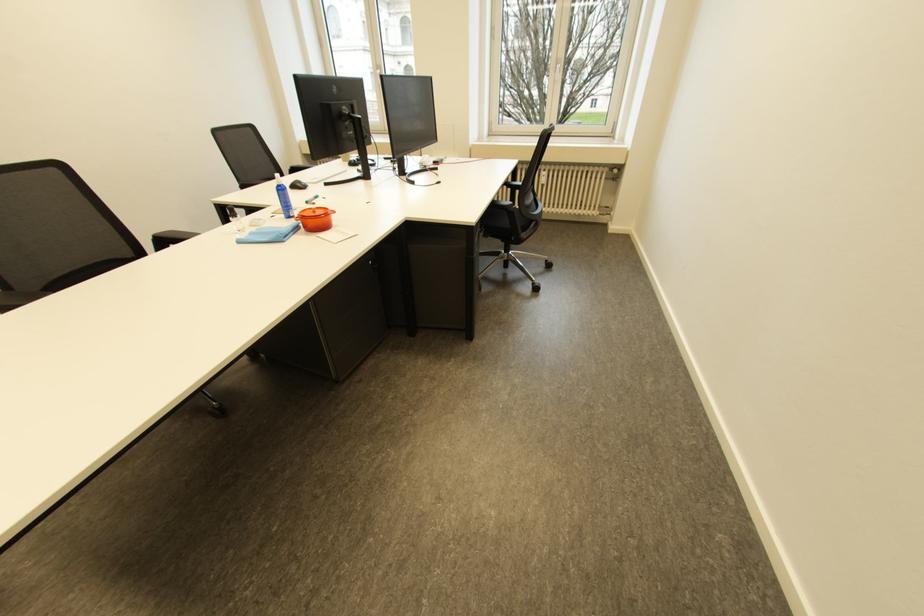
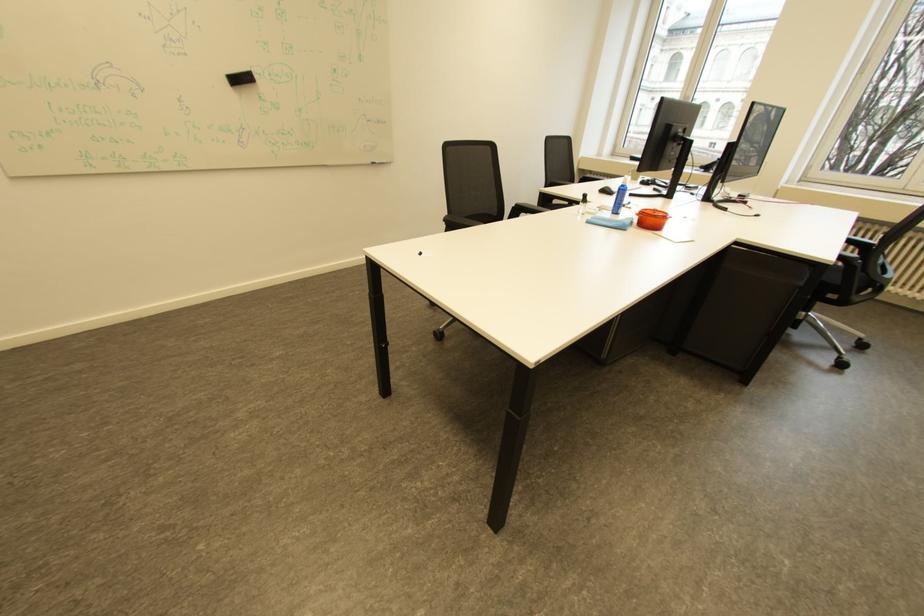
The point at (282, 236) is marked in the first image. Where is the corresponding point in the second image?

(627, 224)